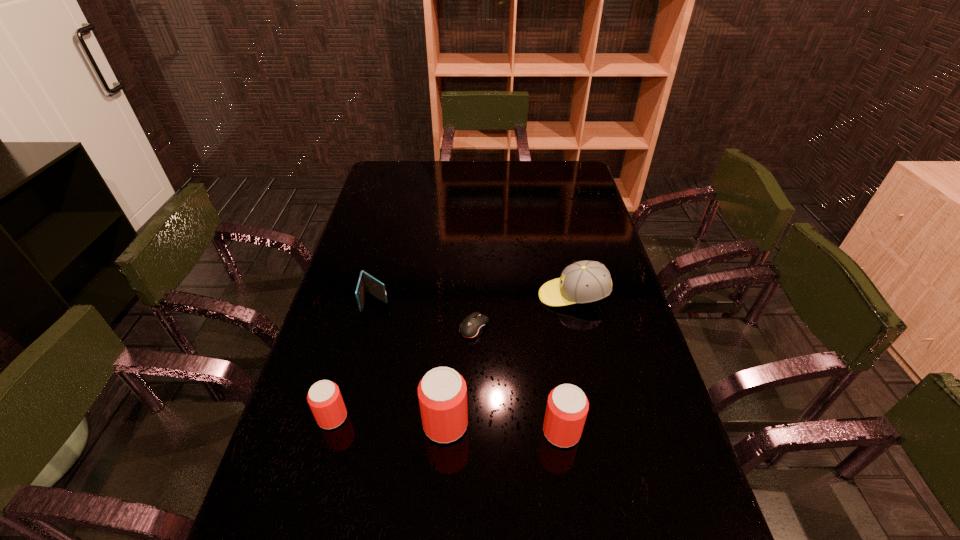
Identify the location of the shortest beer can. (324, 398).

Where is `the tallest beer can`? the tallest beer can is located at coordinates (442, 392).

This screenshot has height=540, width=960. I want to click on the tallest object, so click(x=442, y=392).

Where is `the second shortest beer can`? the second shortest beer can is located at coordinates (567, 406).

You are a GUI agent. You are given a task and a screenshot of the screen. Output one action in this format:
    pyautogui.click(x=<x>, y=<y>)
    Task: Click on the wallet
    The image size is (960, 540).
    Given the screenshot: What is the action you would take?
    pyautogui.click(x=367, y=283)

The image size is (960, 540). I want to click on computer mouse, so [x=472, y=327].

This screenshot has height=540, width=960. What are the coordinates of `the shortest object` in the screenshot? It's located at (472, 327).

Where is `baseball cap`? baseball cap is located at coordinates (582, 282).

Locate an element on the screen. vacant space located on the back of the shortest beer can is located at coordinates (360, 315).

At what (x,y) coordinates should I click in order to perform the action: click on vacant position located 0.170m on the right of the second beer can from left to right. Please return your answer as a coordinate pair (x, y). This screenshot has width=960, height=540. Looking at the image, I should click on (540, 424).